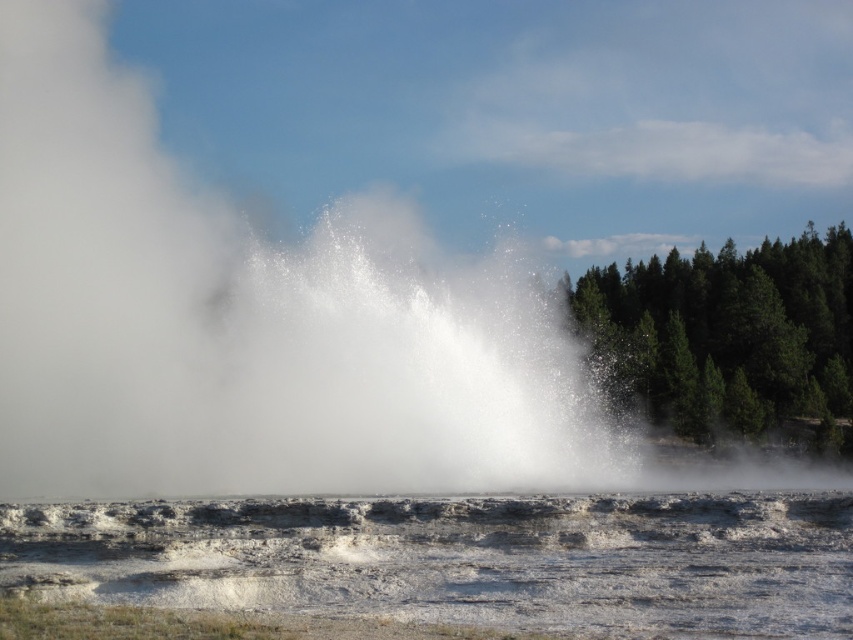
You are a GUI agent. You are given a task and a screenshot of the screen. Output one action in this format:
    pyautogui.click(x=<x>, y=<y>)
    Task: Click on the white vapor at center
    The width and height of the screenshot is (853, 640).
    Given the screenshot: What is the action you would take?
    pyautogui.click(x=250, y=323)

Looking at this image, can you confirm if white vapor at center is taller than green textured trees at right?

Yes.

Who is more forward, [364,396] or [622,339]?

Positioned in front is point [364,396].

Where is `white vapor at center`? The width and height of the screenshot is (853, 640). white vapor at center is located at coordinates (250, 323).

Can you confirm if white rocky water at center is wider than green textured trees at right?

Incorrect, white rocky water at center's width does not surpass green textured trees at right's.

Is point (590, 547) positioned before point (819, 452)?

Yes, point (590, 547) is closer to viewer.

The width and height of the screenshot is (853, 640). Describe the element at coordinates (460, 560) in the screenshot. I see `white rocky water at center` at that location.

Locate an element on the screen. white rocky water at center is located at coordinates (460, 560).

Is point (288, 412) positioned in front of point (428, 584)?

No, (288, 412) is further to viewer.

Can you confirm if white vapor at center is positioned above white rocky water at center?

Indeed, white vapor at center is positioned over white rocky water at center.

Is point (509, 461) positioned behind point (440, 540)?

Yes, it is.

Find the location of `white vapor at center`. white vapor at center is located at coordinates (250, 323).